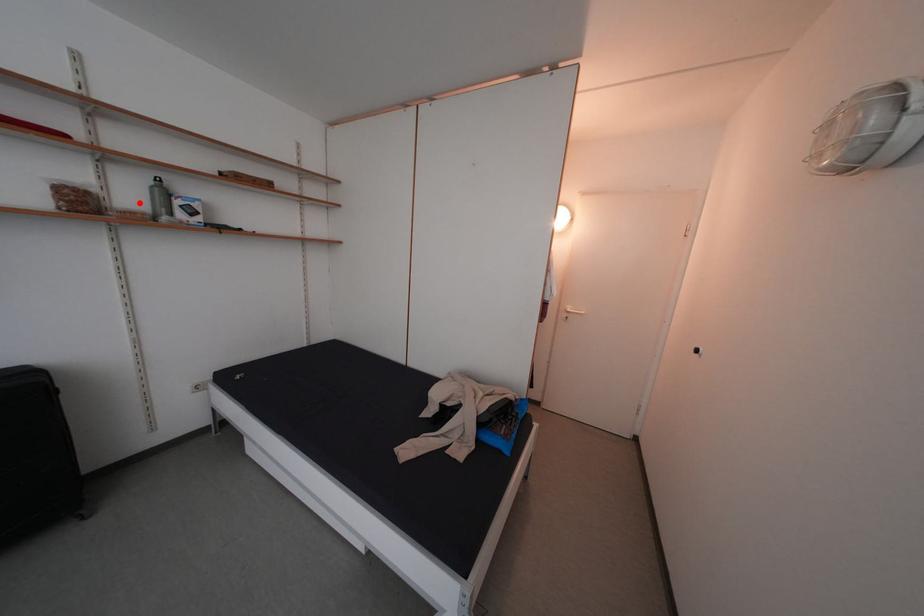
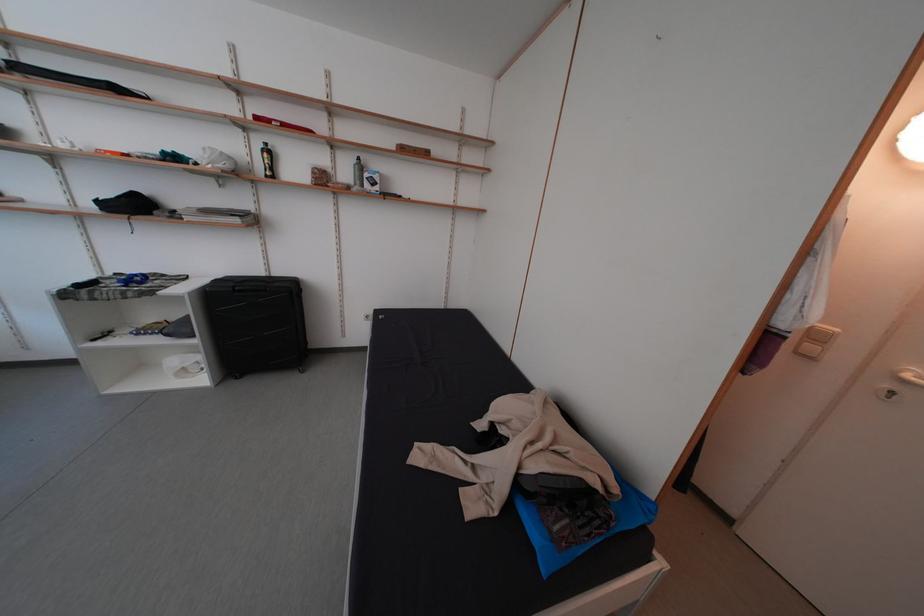
Locate, in the second image, the point that corresponds to the highlighted location in the first image.

(354, 179)